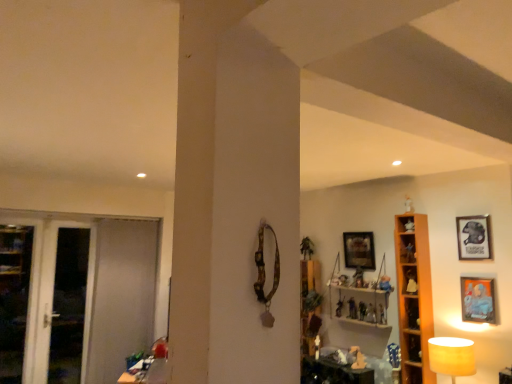
Find the location of a particular element. This screenshot has width=512, height=384. vacant area on top of white glossy screen door at left, the 1th screen door viewed from the left (from a real-world perspective) is located at coordinates (72, 218).